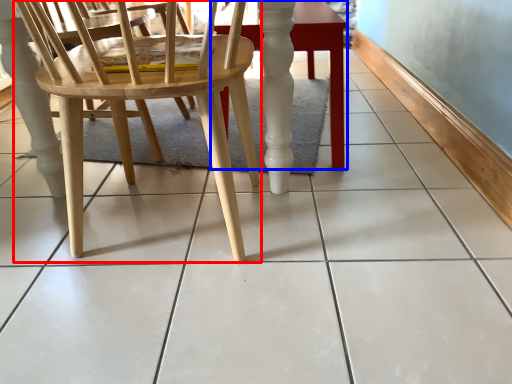
Question: Which point is further to the camera, chair (highlighted by a red box) or table (highlighted by a blue box)?

Choices:
 (A) chair
 (B) table

Answer: (B)